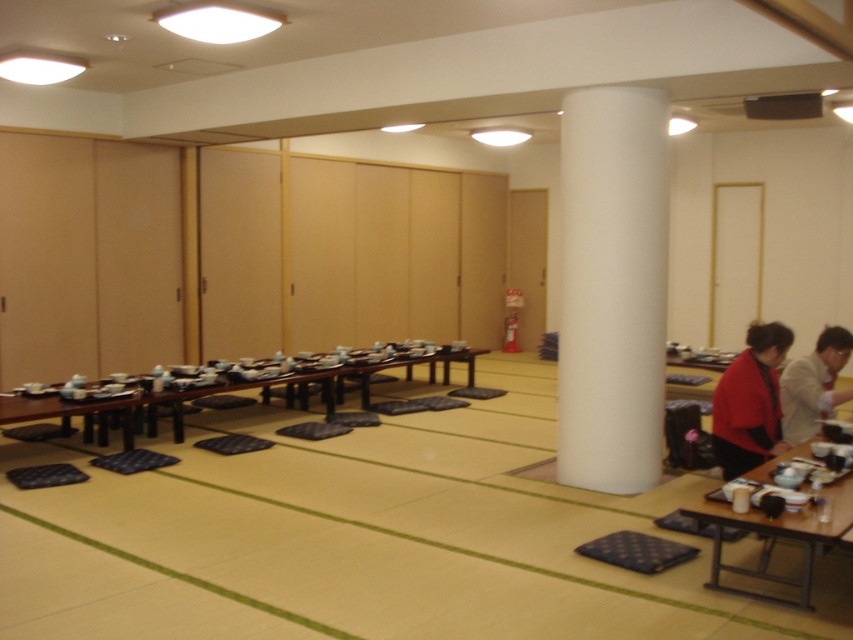
Question: Is blue textured mat at center bigger than blue fabric mat at center?

Choices:
 (A) no
 (B) yes

Answer: (A)

Question: Which of these objects is positioned farthest from the matte red jacket at right?

Choices:
 (A) white matte column at center
 (B) dark gray fabric mat at center
 (C) blue fabric mat at center

Answer: (C)

Question: From the image, what is the correct spatial relationship of matte beige jacket at right in relation to dark blue textured mat at lower left?

Choices:
 (A) right
 (B) left

Answer: (A)

Question: Which of the following is the farthest from the observer?

Choices:
 (A) (601, 547)
 (B) (318, 374)

Answer: (B)

Question: Does blue textured mat at center have a greater width compared to blue fabric mat at center?

Choices:
 (A) yes
 (B) no

Answer: (A)

Question: Which object is positioned farthest from the dark blue textured mat at lower left?

Choices:
 (A) blue fabric mat at center
 (B) wooden table at center
 (C) blue textured mat at center

Answer: (B)